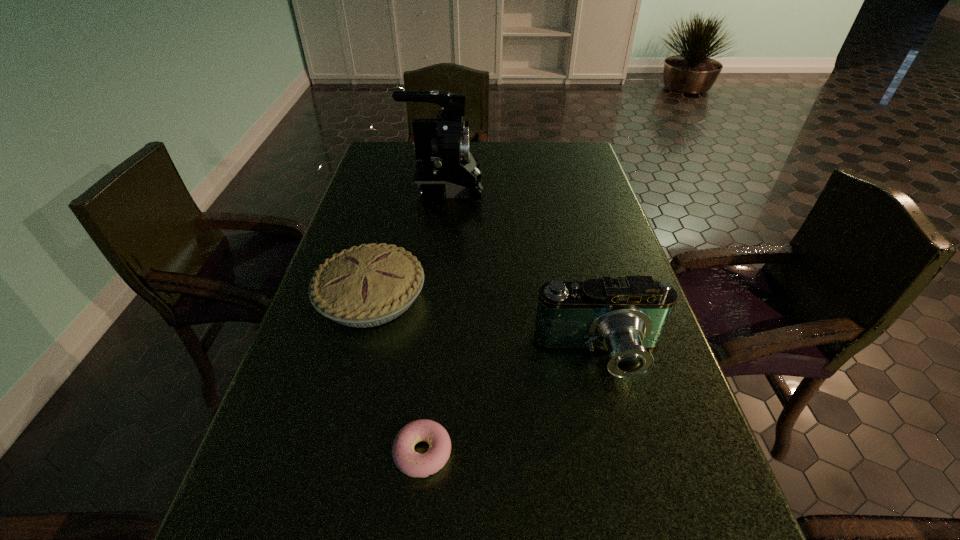
Where is `unoccupied position between the pie and the taller camcorder`? This screenshot has width=960, height=540. unoccupied position between the pie and the taller camcorder is located at coordinates (407, 243).

Where is `object that is the third closest to the nearer camcorder`? object that is the third closest to the nearer camcorder is located at coordinates (445, 168).

You are a GUI agent. You are given a task and a screenshot of the screen. Output one action in this format:
    pyautogui.click(x=<x>, y=<y>)
    Task: Click on the object that stands as the second closest to the farther camcorder
    The image size is (960, 540).
    Given the screenshot: What is the action you would take?
    pyautogui.click(x=627, y=316)

Locate an element on the screen. free space in the image that satisfies the following two spatial constraints: 1. on the front side of the second shortest object; 2. on the right side of the doughnut is located at coordinates (331, 453).

At what (x,y) coordinates should I click in order to perform the action: click on free space that satisfies the following two spatial constraints: 1. on the lens mount of the farthest object; 2. on the left side of the doughnut. Please return your answer as a coordinate pair (x, y). Looking at the image, I should click on (412, 453).